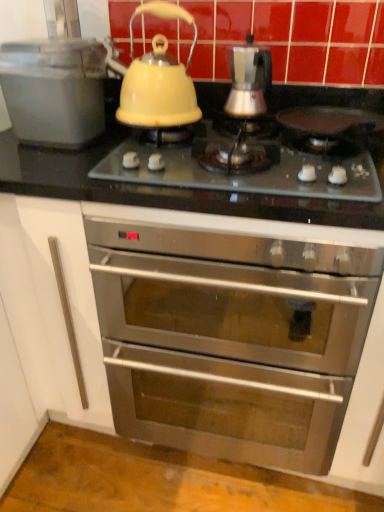
Measure the distance between point (175, 13) and camera.

The distance of point (175, 13) from camera is 3.36 feet.

Locate an element on the screen. Image resolution: width=384 pixels, height=512 pixels. satin silver coffee maker at center, positioned as the 2th kitchen appliance in left-to-right order is located at coordinates (248, 80).

This screenshot has width=384, height=512. Identify the location of yellow glossy kettle at upper center. (157, 78).

Who is more distant, satin silver coffee maker at center, positioned as the 2th kitchen appliance in left-to-right order, or yellow glossy kettle at upper center?

satin silver coffee maker at center, positioned as the 2th kitchen appliance in left-to-right order.

Considering the sizes of objects satin silver coffee maker at center, positioned as the 2th kitchen appliance in left-to-right order, and yellow glossy kettle at upper center in the image provided, who is bigger, satin silver coffee maker at center, positioned as the 2th kitchen appliance in left-to-right order, or yellow glossy kettle at upper center?

yellow glossy kettle at upper center is bigger.

Where is `kettle lying in front of the satin silver coffee maker at center, positioned as the 2th kitchen appliance in left-to-right order`? The height and width of the screenshot is (512, 384). kettle lying in front of the satin silver coffee maker at center, positioned as the 2th kitchen appliance in left-to-right order is located at coordinates (157, 78).

Who is taller, matte plastic container at left, placed as the 1th kitchen appliance when sorted from left to right, or yellow glossy kettle at upper center?

With more height is yellow glossy kettle at upper center.

From the image's perspective, which one is positioned lower, matte plastic container at left, placed as the 2th kitchen appliance when sorted from right to left, or yellow glossy kettle at upper center?

matte plastic container at left, placed as the 2th kitchen appliance when sorted from right to left.

Is matte plastic container at left, placed as the 2th kitchen appliance when sorted from right to left, looking in the opposite direction of yellow glossy kettle at upper center?

No.

Considering the positions of point (85, 123) and point (129, 23), is point (85, 123) closer or farther from the camera than point (129, 23)?

Point (85, 123) is positioned farther from the camera compared to point (129, 23).

Is satin silver coffee maker at center, which ranks as the 1th kitchen appliance in right-to-left order, directly adjacent to matte glass cooktop at center?

satin silver coffee maker at center, which ranks as the 1th kitchen appliance in right-to-left order, and matte glass cooktop at center are clearly separated.

How distant is satin silver coffee maker at center, positioned as the 2th kitchen appliance in left-to-right order, from matte glass cooktop at center?

satin silver coffee maker at center, positioned as the 2th kitchen appliance in left-to-right order, and matte glass cooktop at center are 25.54 centimeters apart.

Consider the image. Could you tell me if satin silver coffee maker at center, which ranks as the 1th kitchen appliance in right-to-left order, is turned towards matte glass cooktop at center?

No.

Which is closer to the camera, (235,80) or (328,164)?

Point (235,80) is positioned farther from the camera compared to point (328,164).

Which of these two, stainless steel oven at center or satin silver coffee maker at center, positioned as the 2th kitchen appliance in left-to-right order, stands shorter?

With less height is satin silver coffee maker at center, positioned as the 2th kitchen appliance in left-to-right order.

In the image, is stainless steel oven at center positioned in front of or behind satin silver coffee maker at center, which ranks as the 1th kitchen appliance in right-to-left order?

stainless steel oven at center is in front of satin silver coffee maker at center, which ranks as the 1th kitchen appliance in right-to-left order.

From the image's perspective, does matte glass cooktop at center appear higher than matte plastic container at left, placed as the 2th kitchen appliance when sorted from right to left?

No, from the image's perspective, matte glass cooktop at center is not above matte plastic container at left, placed as the 2th kitchen appliance when sorted from right to left.

Could matte plastic container at left, placed as the 2th kitchen appliance when sorted from right to left, be considered to be inside matte glass cooktop at center?

Definitely not — matte plastic container at left, placed as the 2th kitchen appliance when sorted from right to left, is not inside matte glass cooktop at center.

Is matte glass cooktop at center not close to matte plastic container at left, placed as the 2th kitchen appliance when sorted from right to left?

They are positioned close to each other.

Based on their sizes in the image, would you say matte glass cooktop at center is bigger or smaller than matte plastic container at left, placed as the 2th kitchen appliance when sorted from right to left?

matte glass cooktop at center is bigger than matte plastic container at left, placed as the 2th kitchen appliance when sorted from right to left.

Who is taller, stainless steel oven at center or matte glass cooktop at center?

Standing taller between the two is stainless steel oven at center.

Consider the image. Is stainless steel oven at center to the left of matte glass cooktop at center from the viewer's perspective?

Yes.

Identify the location of gas stove that appears on the right of stainless steel oven at center. The width and height of the screenshot is (384, 512). (243, 174).

Is matte glass cooktop at center a part of stainless steel oven at center?

No.

Identify the location of kitchen appliance on the left side of stainless steel oven at center. (54, 90).

Looking at this image, in terms of width, does matte plastic container at left, placed as the 1th kitchen appliance when sorted from left to right, look wider or thinner when compared to stainless steel oven at center?

matte plastic container at left, placed as the 1th kitchen appliance when sorted from left to right, is thinner than stainless steel oven at center.

Does point (17, 98) come in front of point (161, 433)?

Yes, point (17, 98) is closer to viewer.

Locate an element on the screen. This screenshot has width=384, height=512. kettle in front of the satin silver coffee maker at center, positioned as the 2th kitchen appliance in left-to-right order is located at coordinates (157, 78).

There is a yellow glossy kettle at upper center. At what (x,y) coordinates should I click in order to perform the action: click on the 2nd kitchen appliance below it (from the image's perspective). Please return your answer as a coordinate pair (x, y). Image resolution: width=384 pixels, height=512 pixels. Looking at the image, I should click on (54, 90).

Looking at the image, which one is located closer to yellow glossy kettle at upper center, satin silver coffee maker at center, which ranks as the 1th kitchen appliance in right-to-left order, or matte glass cooktop at center?

Based on the image, satin silver coffee maker at center, which ranks as the 1th kitchen appliance in right-to-left order, appears to be nearer to yellow glossy kettle at upper center.

Considering their positions, is matte glass cooktop at center positioned closer to satin silver coffee maker at center, positioned as the 2th kitchen appliance in left-to-right order, than stainless steel oven at center?

Based on the image, matte glass cooktop at center appears to be nearer to satin silver coffee maker at center, positioned as the 2th kitchen appliance in left-to-right order.

Considering their positions, is stainless steel oven at center positioned closer to satin silver coffee maker at center, positioned as the 2th kitchen appliance in left-to-right order, than matte plastic container at left, placed as the 1th kitchen appliance when sorted from left to right?

The object closer to satin silver coffee maker at center, positioned as the 2th kitchen appliance in left-to-right order, is matte plastic container at left, placed as the 1th kitchen appliance when sorted from left to right.

From the image, which object appears to be farther from yellow glossy kettle at upper center, stainless steel oven at center or matte plastic container at left, placed as the 1th kitchen appliance when sorted from left to right?

stainless steel oven at center is further to yellow glossy kettle at upper center.

When comparing their distances from satin silver coffee maker at center, positioned as the 2th kitchen appliance in left-to-right order, does matte plastic container at left, placed as the 1th kitchen appliance when sorted from left to right, or matte glass cooktop at center seem further?

matte plastic container at left, placed as the 1th kitchen appliance when sorted from left to right, is positioned further to the anchor satin silver coffee maker at center, positioned as the 2th kitchen appliance in left-to-right order.

From the image, which object appears to be nearer to matte glass cooktop at center, satin silver coffee maker at center, positioned as the 2th kitchen appliance in left-to-right order, or yellow glossy kettle at upper center?

yellow glossy kettle at upper center lies closer to matte glass cooktop at center than the other object.

From the image, which object appears to be farther from matte plastic container at left, placed as the 2th kitchen appliance when sorted from right to left, stainless steel oven at center or yellow glossy kettle at upper center?

Among the two, stainless steel oven at center is located further to matte plastic container at left, placed as the 2th kitchen appliance when sorted from right to left.

When comparing their distances from satin silver coffee maker at center, positioned as the 2th kitchen appliance in left-to-right order, does matte plastic container at left, placed as the 1th kitchen appliance when sorted from left to right, or stainless steel oven at center seem closer?

Based on the image, matte plastic container at left, placed as the 1th kitchen appliance when sorted from left to right, appears to be nearer to satin silver coffee maker at center, positioned as the 2th kitchen appliance in left-to-right order.

Identify the location of kettle situated between matte plastic container at left, placed as the 2th kitchen appliance when sorted from right to left, and matte glass cooktop at center from left to right. The width and height of the screenshot is (384, 512). (157, 78).

I want to click on kettle between matte plastic container at left, placed as the 2th kitchen appliance when sorted from right to left, and satin silver coffee maker at center, positioned as the 2th kitchen appliance in left-to-right order, from left to right, so click(157, 78).

In order to click on gas stove between yellow glossy kettle at upper center and stainless steel oven at center in the vertical direction in this screenshot , I will do `click(243, 174)`.

Where is `gas stove located between matte plastic container at left, placed as the 2th kitchen appliance when sorted from right to left, and satin silver coffee maker at center, which ranks as the 1th kitchen appliance in right-to-left order, in the left-right direction`? gas stove located between matte plastic container at left, placed as the 2th kitchen appliance when sorted from right to left, and satin silver coffee maker at center, which ranks as the 1th kitchen appliance in right-to-left order, in the left-right direction is located at coordinates (243, 174).